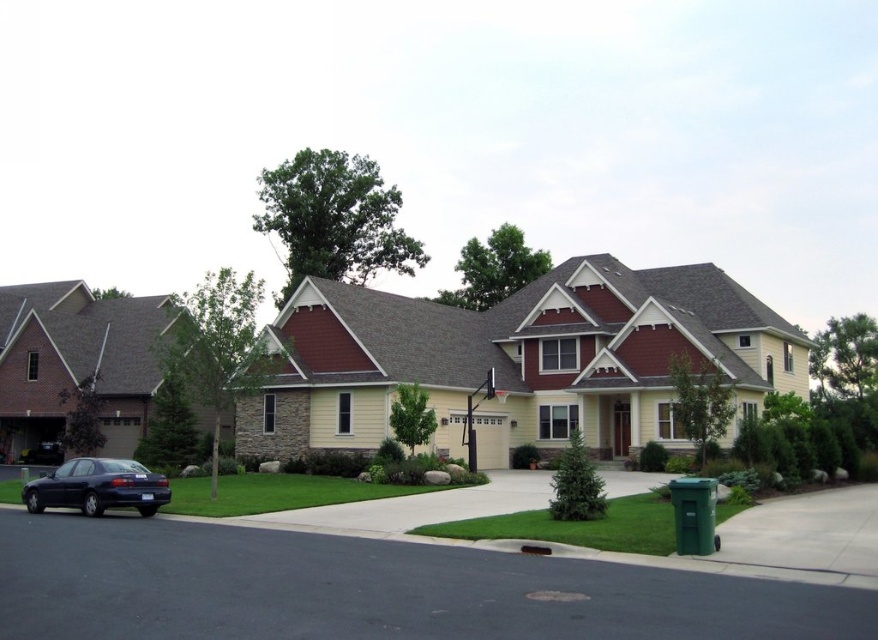
Question: Does asphalt at lower center have a larger size compared to shiny dark blue sedan at lower left?

Choices:
 (A) yes
 (B) no

Answer: (B)

Question: Which point is farther from the camera taking this photo?

Choices:
 (A) (171, 632)
 (B) (130, 476)

Answer: (B)

Question: Which object is closer to the camera taking this photo?

Choices:
 (A) shiny dark blue sedan at lower left
 (B) asphalt at lower center

Answer: (B)

Question: Is asphalt at lower center to the right of shiny dark blue sedan at lower left from the viewer's perspective?

Choices:
 (A) no
 (B) yes

Answer: (B)

Question: In this image, where is asphalt at lower center located relative to shiny dark blue sedan at lower left?

Choices:
 (A) above
 (B) below

Answer: (A)